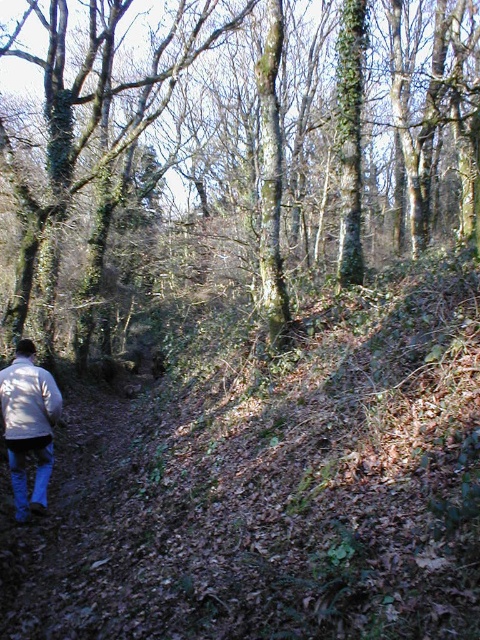
You are standing in the forest and see a point marked at coordinates (229, 154). According to the scene description, where exactly is this point located?

The point at (229, 154) is on the green rough bark tree at center.

You are standing in the forest and want to reach the white matte jacket at lower left. Which direction should you move relative to the green rough bark tree at center to get closer to the jacket?

Since the green rough bark tree at center is closer to you than the white matte jacket at lower left, you should move away from the green rough bark tree at center to get closer to the white matte jacket at lower left.

In the scene shown: You are a hiker who wants to take a photo of the white matte jacket at lower left and the green rough bark tree at center. Which object is wider in the image?

The green rough bark tree at center is wider than the white matte jacket at lower left.